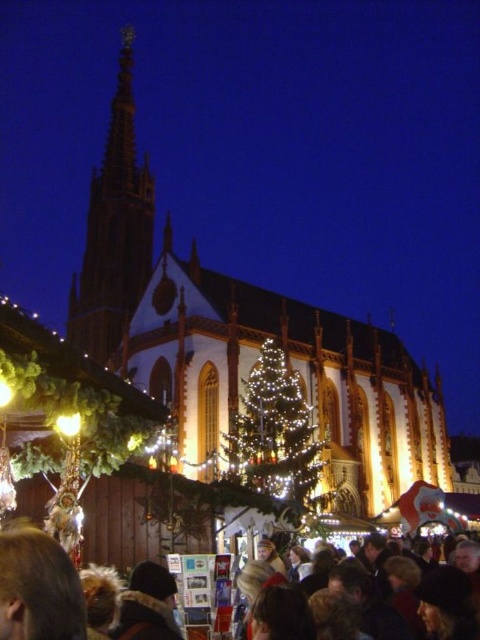
You are standing in the Christmas market and want to take a photo of the white stone church at center and the shiny gold spire at upper left. Which object should you point your camera towards first if you want to capture both in one frame?

You should point your camera towards the shiny gold spire at upper left first because the white stone church at center is below it, so by framing the spire at the top, you can include the church below in the same shot.

You are a photographer planning to capture the entire scene of the white stone church at center and the shiny gold spire at upper left in one shot. Based on their sizes, do you think you can fit both in the frame without zooming in?

The white stone church at center might be wider than shiny gold spire at upper left, so it is possible to fit both in the frame without zooming in as the church is likely wider and the spire is positioned at the upper left, allowing them to coexist within the same shot.

You are standing in the festive Christmas market scene. You see the illuminated glass Christmas tree at center. If you want to place a new stall exactly 0.3 meters to the right of the tree, where would that position be in coordinates?

The new stall would be positioned at coordinates approximately 0.981 on the x and 0.573 on the y, since moving 0.3 meters to the right adds to the x coordinate while keeping the y the same as the illuminated glass Christmas tree at center.